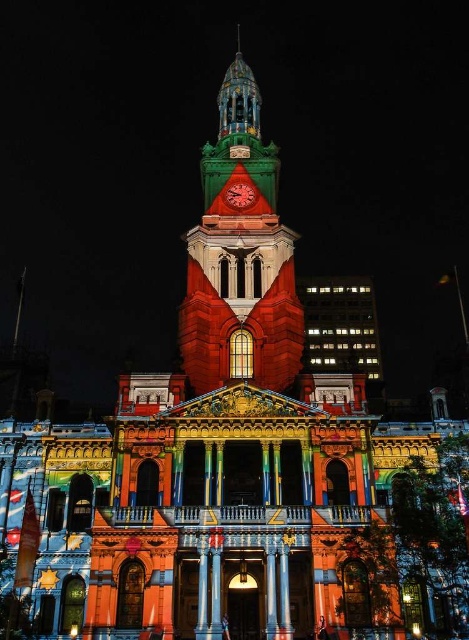
You are standing in front of the grand, ornate building at night. You notice two points on the building labeled as point (263, 380) and point (248, 204). Which point is closer to you?

Point (263, 380) is closer to the camera than point (248, 204), so the point closer to you is point (263, 380).

You are an architect assessing the building for maintenance. You need to determine which structure requires a taller ladder for inspection between the green stone clock tower at center and the metallic clock at center. Which one would need a taller ladder?

The green stone clock tower at center requires a taller ladder for inspection because it has a greater height compared to the metallic clock at center.